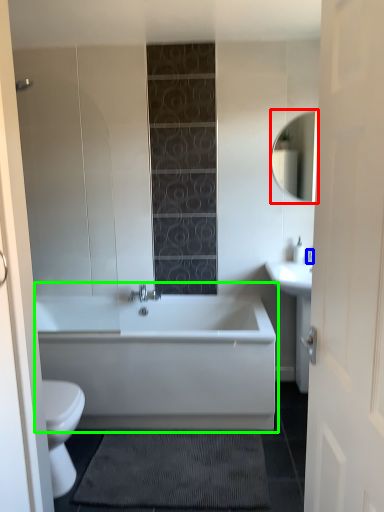
Question: Which is farther away from mirror (highlighted by a red box)? faucet (highlighted by a blue box) or bathtub (highlighted by a green box)?

Choices:
 (A) faucet
 (B) bathtub

Answer: (B)